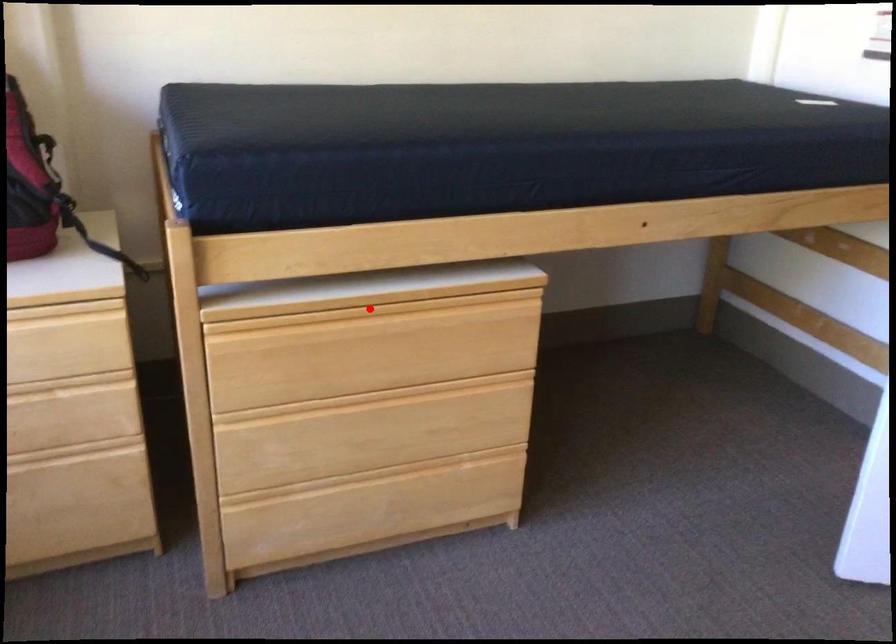
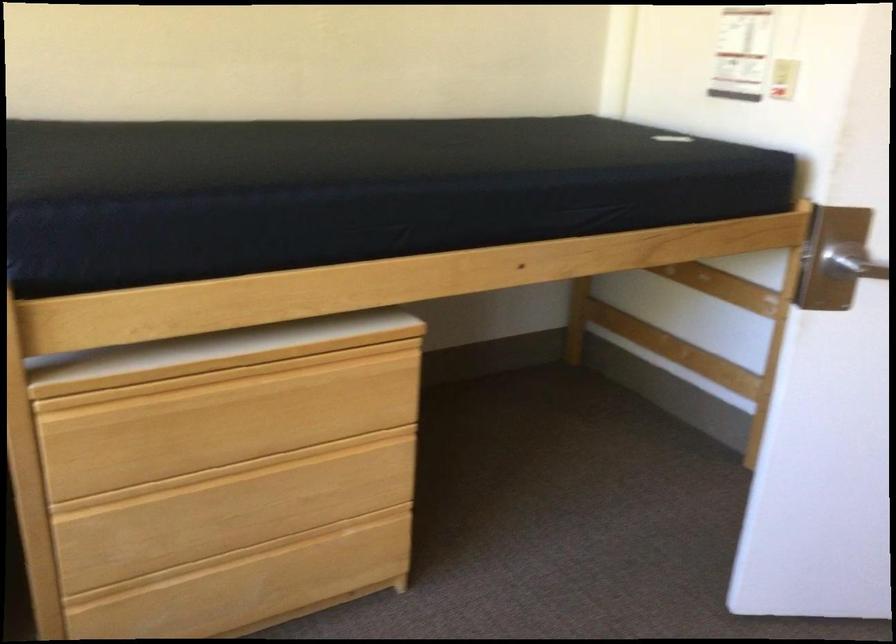
Question: I am providing you with two images of the same scene from different viewpoints. A red point is shown in image1. For the corresponding object point in image2, is it positioned nearer or farther from the camera?

Choices:
 (A) Nearer
 (B) Farther

Answer: (A)